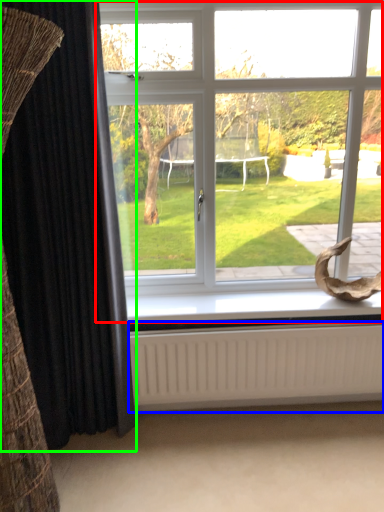
Question: Considering the real-world distances, which object is closest to window (highlighted by a red box)? radiator (highlighted by a blue box) or curtain (highlighted by a green box).

Choices:
 (A) radiator
 (B) curtain

Answer: (A)